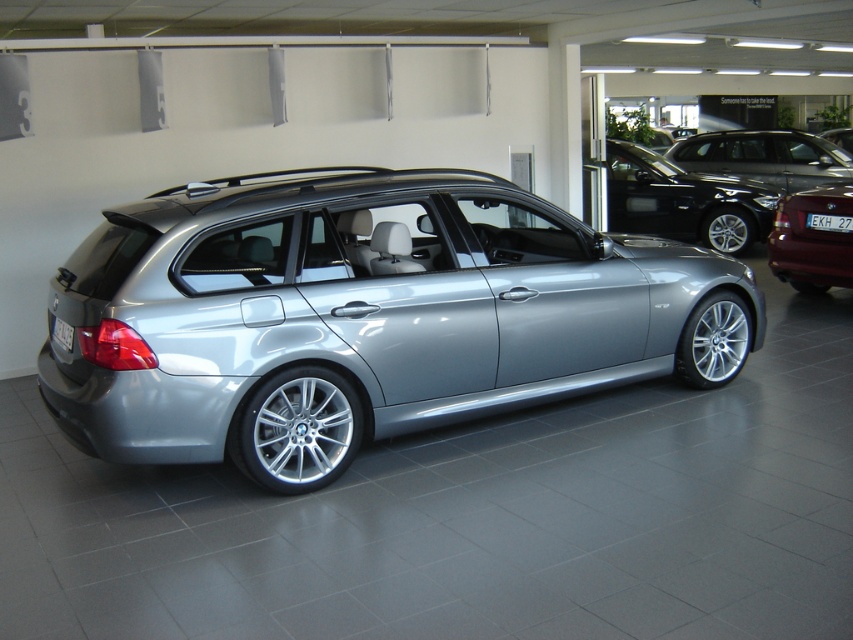
Question: Does metallic red car at right appear on the left side of black plastic license plate at rear?

Choices:
 (A) yes
 (B) no

Answer: (B)

Question: Can you confirm if satin black car at upper center is thinner than black plastic license plate at center?

Choices:
 (A) yes
 (B) no

Answer: (B)

Question: Estimate the real-world distances between objects in this image. Which object is closer to the metallic red car at right?

Choices:
 (A) satin black car at upper center
 (B) black plastic license plate at rear
 (C) satin black sedan at upper center

Answer: (C)

Question: Does satin silver car at center lie in front of satin black car at upper center?

Choices:
 (A) no
 (B) yes

Answer: (B)

Question: Which is nearer to the metallic red car at right?

Choices:
 (A) satin silver car at center
 (B) satin black car at upper center

Answer: (A)

Question: Which point is closer to the camera?

Choices:
 (A) satin silver car at center
 (B) black plastic license plate at center
 (C) metallic red car at right

Answer: (A)